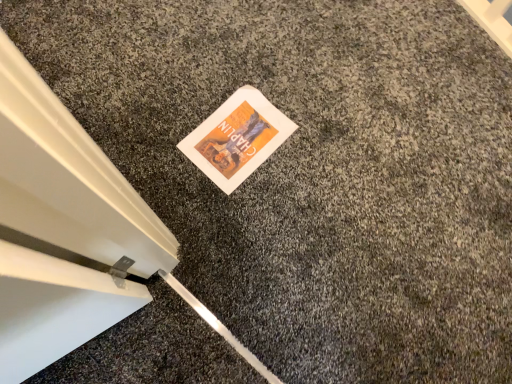
You are a GUI agent. You are given a task and a screenshot of the screen. Output one action in this format:
    pyautogui.click(x=<x>, y=<y>)
    Task: Click on the vacant area on top of white paper at center (from a real-world perspective)
    The image size is (512, 384).
    Given the screenshot: What is the action you would take?
    pyautogui.click(x=236, y=132)